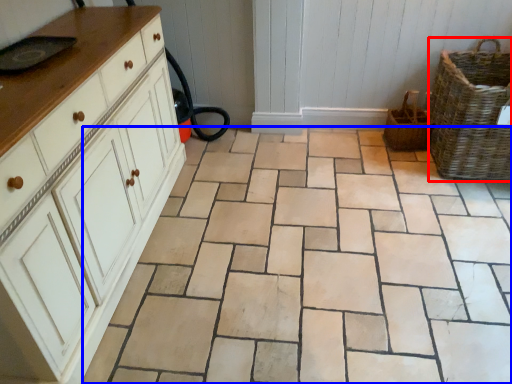
Question: Which object is closer to the camera taking this photo, basket (highlighted by a red box) or ceramic tile (highlighted by a blue box)?

Choices:
 (A) basket
 (B) ceramic tile

Answer: (B)